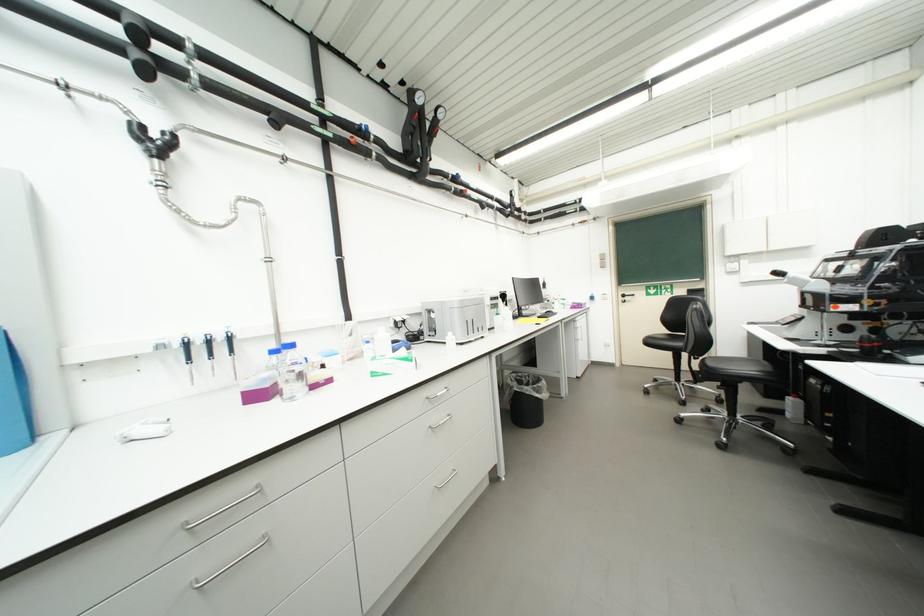
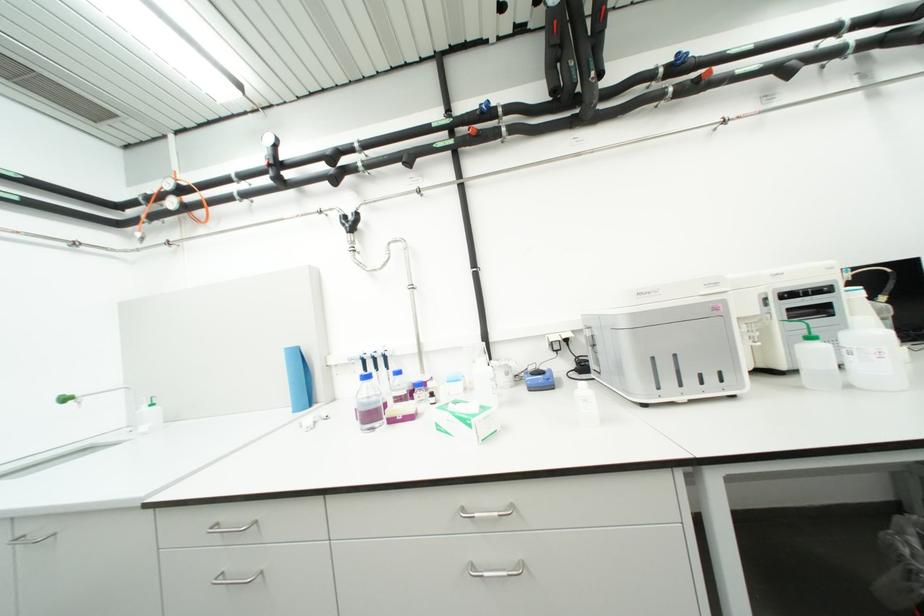
Locate, in the second image, the point that corresponds to [322,387] in the first image.

(399, 422)